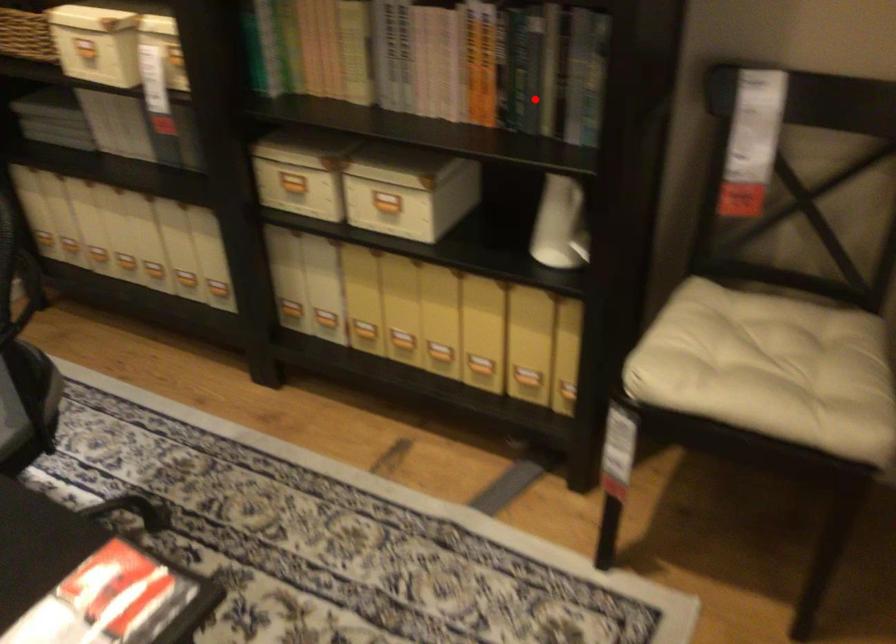
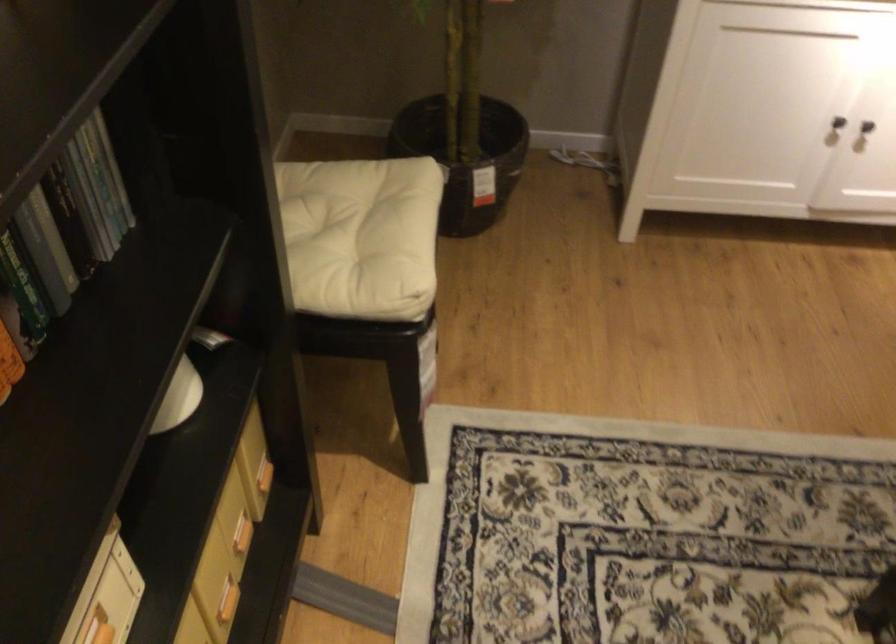
The point at the highlighted location is marked in the first image. Where is the corresponding point in the second image?

(22, 288)